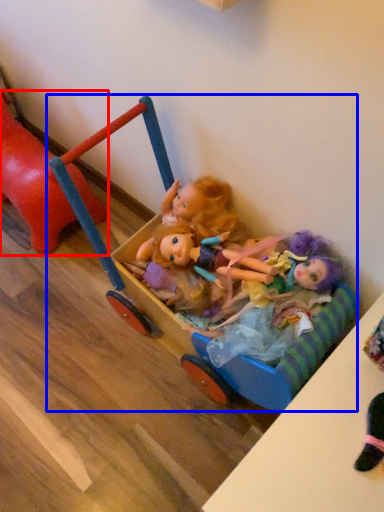
Question: Which object is further to the camera taking this photo, toy (highlighted by a red box) or toy (highlighted by a blue box)?

Choices:
 (A) toy
 (B) toy

Answer: (A)